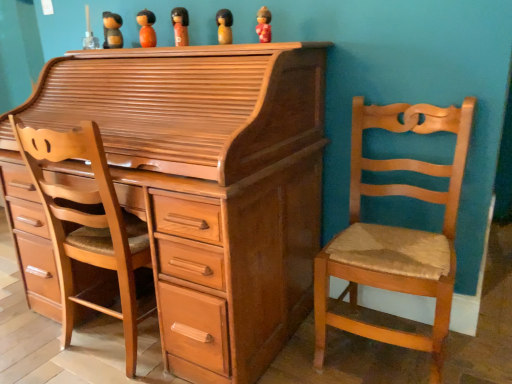
The width and height of the screenshot is (512, 384). I want to click on free spot in front of wooden figurine at upper center, arranged as the fourth toy when viewed from the left, so click(x=232, y=44).